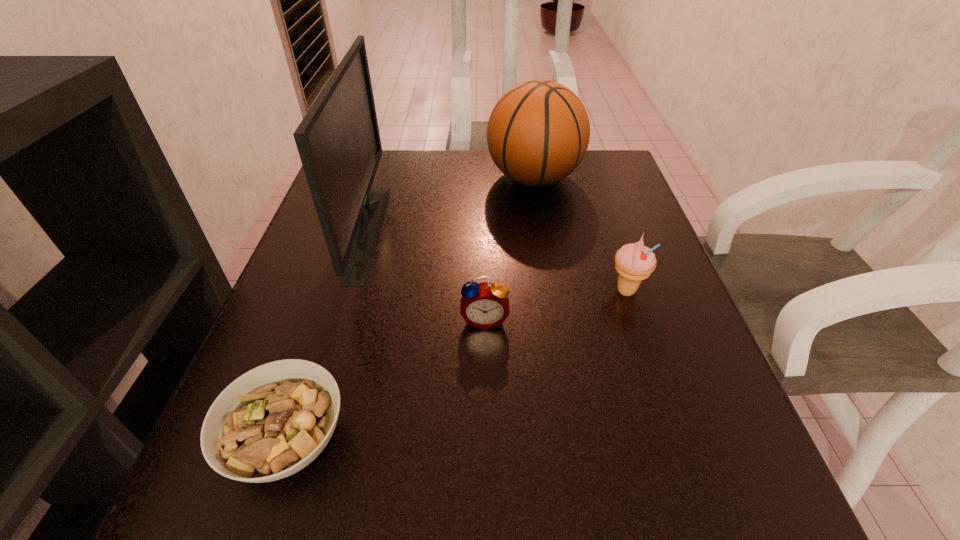
The height and width of the screenshot is (540, 960). Find the location of `vacant position in the image that satisfies the following two spatial constraints: 1. on the back side of the nearest object; 2. on the left side of the icecream`. vacant position in the image that satisfies the following two spatial constraints: 1. on the back side of the nearest object; 2. on the left side of the icecream is located at coordinates (338, 291).

Find the location of `free space in the image that satisfies the following two spatial constraints: 1. on the back side of the second tallest object; 2. on the left side of the shortest object`. free space in the image that satisfies the following two spatial constraints: 1. on the back side of the second tallest object; 2. on the left side of the shortest object is located at coordinates (374, 178).

Find the location of a particular element. vacant space that satisfies the following two spatial constraints: 1. on the front-facing side of the monitor; 2. on the right side of the icecream is located at coordinates (351, 291).

You are a GUI agent. You are given a task and a screenshot of the screen. Output one action in this format:
    pyautogui.click(x=<x>, y=<y>)
    Task: Click on the vacant area that satisfies the following two spatial constraints: 1. on the front side of the second tallest object; 2. on the front-facing side of the monitor
    The height and width of the screenshot is (540, 960).
    Given the screenshot: What is the action you would take?
    pyautogui.click(x=542, y=231)